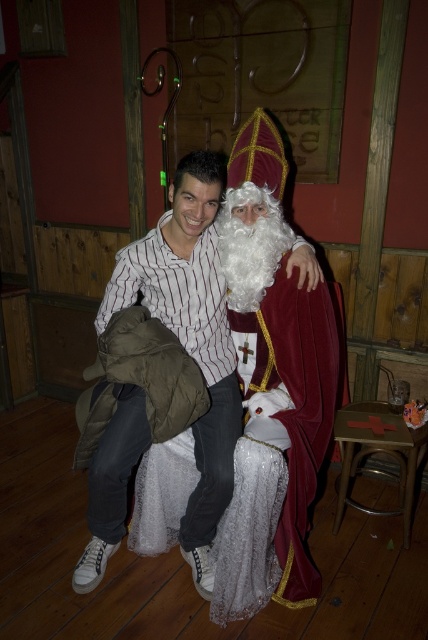
What is the exact 2D coordinate of the velvet maroon robe at center?

The exact 2D coordinate of the velvet maroon robe at center is at point [270,387].

From the picture: You are a photographer at the event and want to capture a photo of both individuals without any obstruction. Given their positions at coordinates point [244,614] and point [181,224], which individual should you position closer to the camera to ensure both are visible clearly?

Point [244,614] is behind point [181,224]. To ensure both individuals are visible without obstruction, position the individual at point [181,224] closer to the camera so that the person behind at point [244,614] can also be seen clearly.

You are organizing a Christmas event and need to arrange two outfits on a display stand. The velvet maroon robe at center and the white striped shirt at center must be placed side by side. Which outfit will require a narrower display stand?

The velvet maroon robe at center requires a narrower display stand because its width is less than that of the white striped shirt at center.